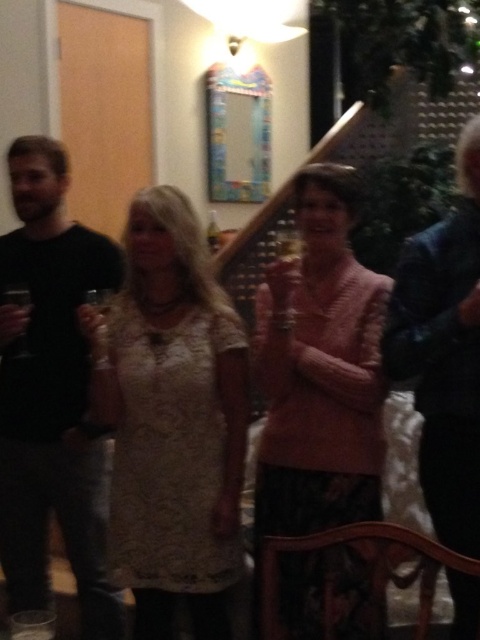
You are a photographer at the event and want to capture a photo of both the white lace dress at center and the clear glass wine glass at left. Given that your camera can only focus on objects wider than 15 cm, will both items be in focus?

The white lace dress at center is wider than the clear glass wine glass at left. Since the dress is wider than 15 cm, it will be in focus. However, the wine glass might not meet the 15 cm width requirement and could be out of focus.

You are at a party and see the black matte shirt at left and the clear plastic cup at lower left. Which object is taller?

The black matte shirt at left is much taller than the clear plastic cup at lower left.